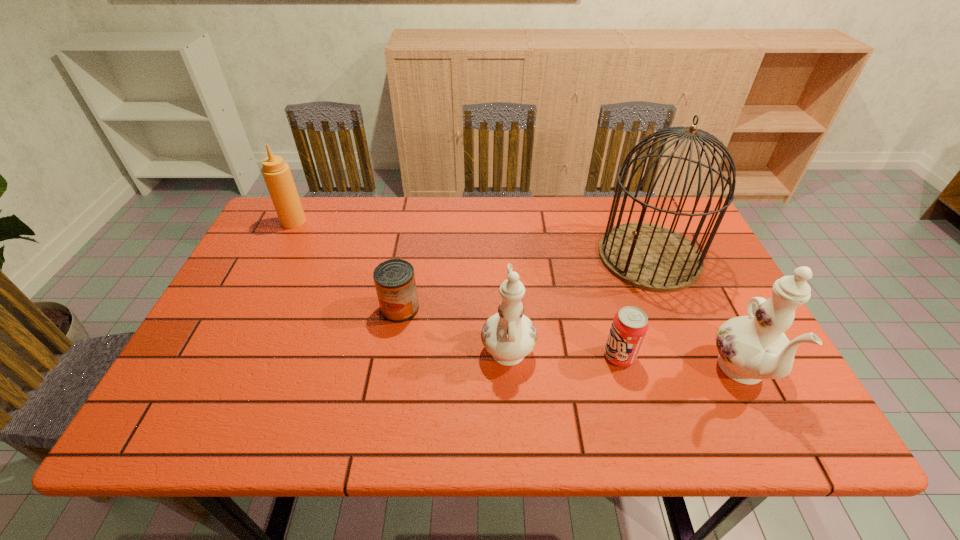
Find the location of a particular element. chinaware positioned at the right edge is located at coordinates (751, 348).

The image size is (960, 540). What are the coordinates of `birdcage at the right edge` in the screenshot? It's located at (648, 256).

The height and width of the screenshot is (540, 960). Find the location of `object at the far left corner`. object at the far left corner is located at coordinates (277, 175).

The image size is (960, 540). I want to click on object present at the far right corner, so click(648, 256).

The width and height of the screenshot is (960, 540). Find the location of `object that is at the near right corner`. object that is at the near right corner is located at coordinates (751, 348).

I want to click on vacant space at the far edge of the desktop, so click(582, 220).

Where is `blank space at the near edge of the desktop`? blank space at the near edge of the desktop is located at coordinates (593, 368).

Where is `vacant area at the left edge`? The height and width of the screenshot is (540, 960). vacant area at the left edge is located at coordinates (277, 266).

You are a GUI agent. You are given a task and a screenshot of the screen. Output one action in this format:
    pyautogui.click(x=<x>, y=<y>)
    Task: Click on the blank space at the right edge of the desktop
    
    Given the screenshot: What is the action you would take?
    pyautogui.click(x=721, y=302)

This screenshot has width=960, height=540. In order to click on vacant space that's between the condiment and the second object from left to right in this screenshot , I will do `click(347, 265)`.